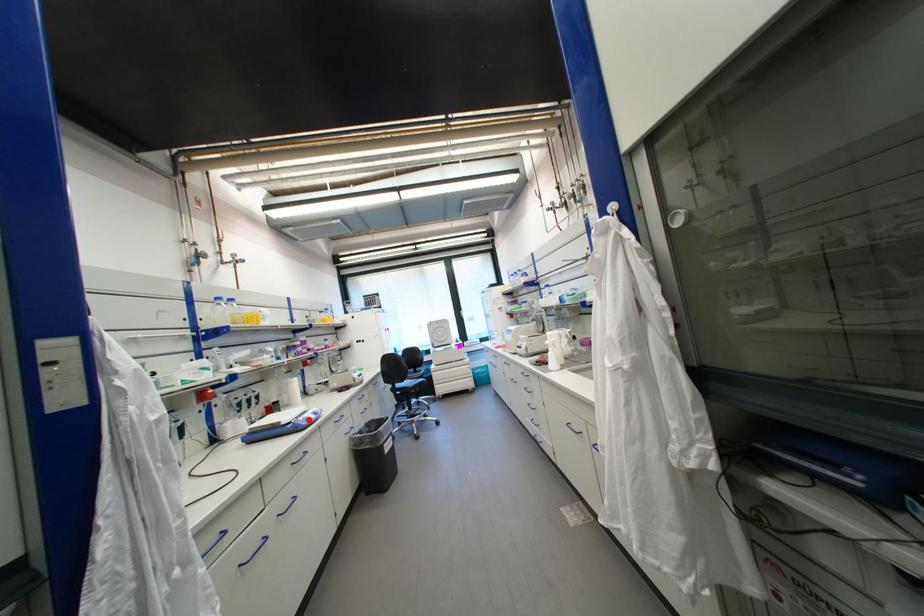
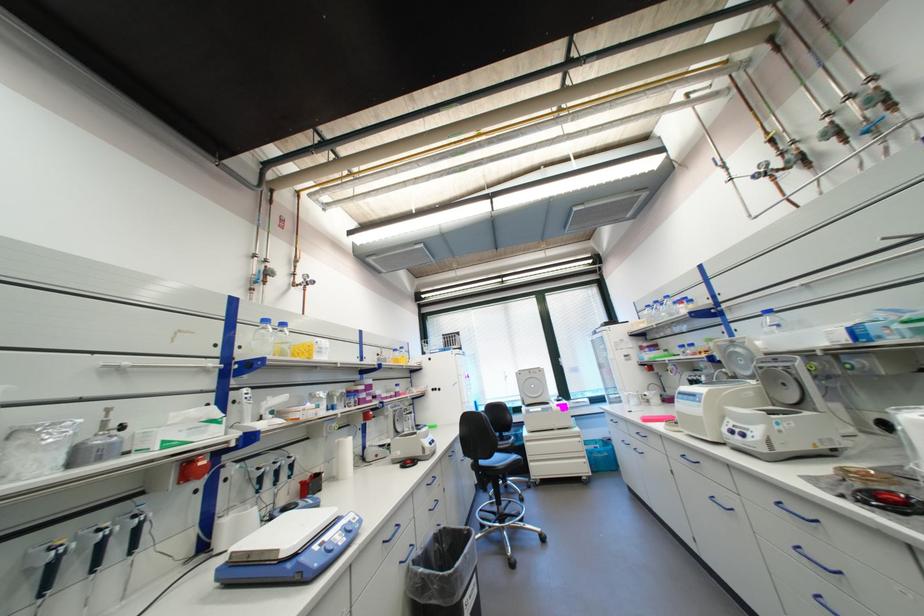
Where in the second image is the point corresponding to the highlighted location from the first image?

(323, 548)